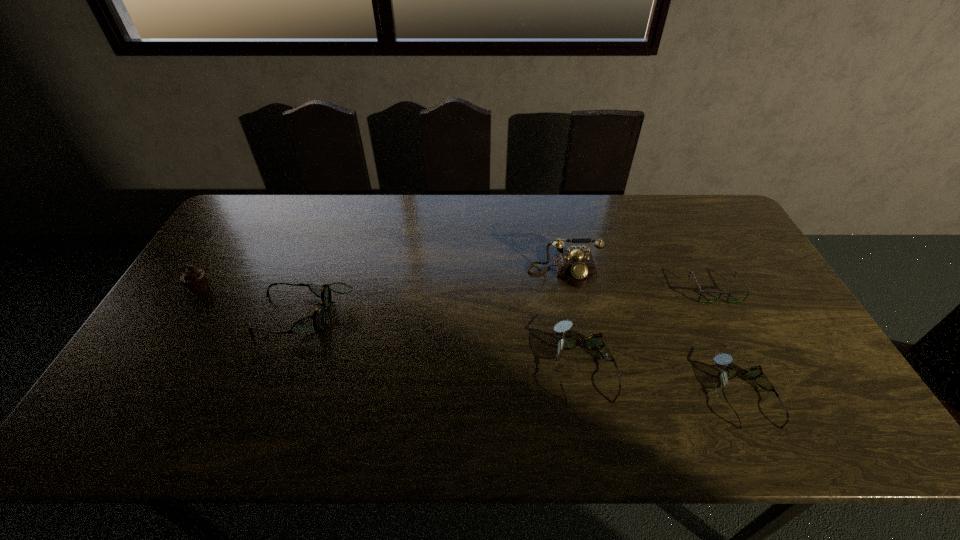
Locate an element on the screen. This screenshot has height=540, width=960. free space between the muffin and the tallest object is located at coordinates (382, 280).

Locate an element on the screen. The height and width of the screenshot is (540, 960). unoccupied area between the tallest object and the second tallest object is located at coordinates (382, 280).

At what (x,y) coordinates should I click in order to perform the action: click on object that can be found as the closest to the telephone. Please return your answer as a coordinate pair (x, y). This screenshot has height=540, width=960. Looking at the image, I should click on coord(594,341).

Image resolution: width=960 pixels, height=540 pixels. In order to click on object that can be found as the fifth closest to the third spectacles from right to left in this screenshot , I will do `click(194, 279)`.

Identify which spectacles is the second nearest to the third shortest object. Please provide its 2D coordinates. Your answer should be formatted as a tuple, i.e. [(x, y)], where the tuple contains the x and y coordinates of a point satisfying the conditions above.

[(748, 292)]

In order to click on spectacles that can be found as the third closest to the tallest object in this screenshot , I will do `click(724, 359)`.